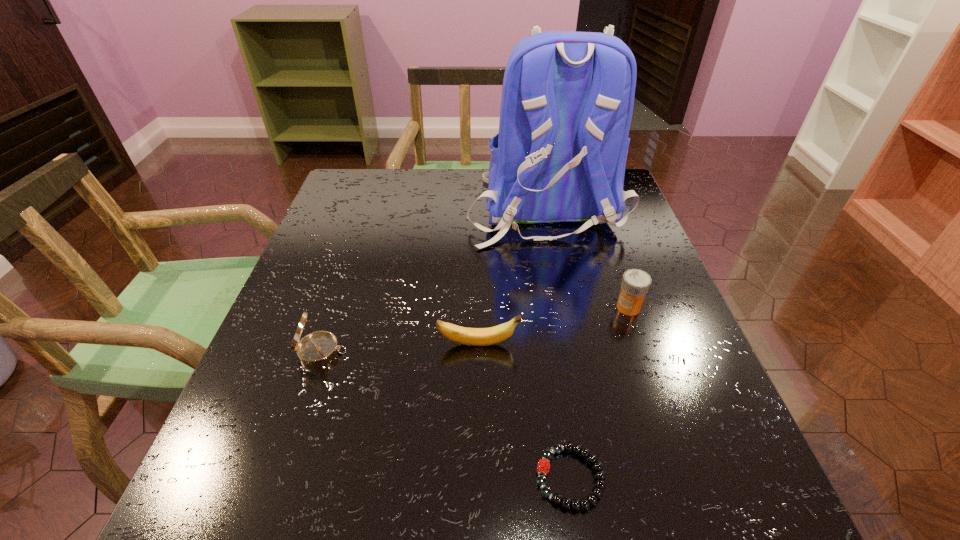
The image size is (960, 540). In order to click on vacant area located on the label side of the medicine in this screenshot , I will do `click(537, 307)`.

This screenshot has width=960, height=540. I want to click on free spot located on the label side of the medicine, so click(522, 307).

This screenshot has width=960, height=540. Identify the location of vacant region located 0.160m at the stem of the banana. (605, 344).

Find the location of `vacant area situated 0.090m on the left of the bracelet`. vacant area situated 0.090m on the left of the bracelet is located at coordinates (473, 477).

Where is `object that is positioned at the far edge`? This screenshot has width=960, height=540. object that is positioned at the far edge is located at coordinates [567, 100].

What are the coordinates of `object positioned at the near edge` in the screenshot? It's located at (543, 466).

Locate an element on the screen. This screenshot has width=960, height=540. object positioned at the left edge is located at coordinates (319, 348).

In order to click on backpack at the right edge in this screenshot , I will do `click(567, 100)`.

Find the location of a particular element. This screenshot has height=540, width=960. medicine present at the right edge is located at coordinates (635, 284).

This screenshot has height=540, width=960. In order to click on object located in the far right corner section of the desktop in this screenshot , I will do `click(567, 100)`.